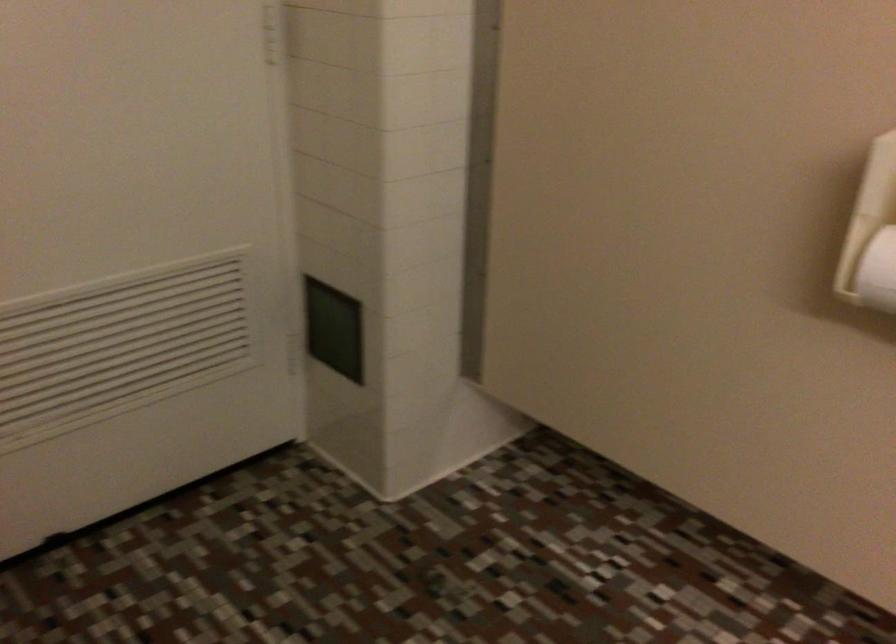
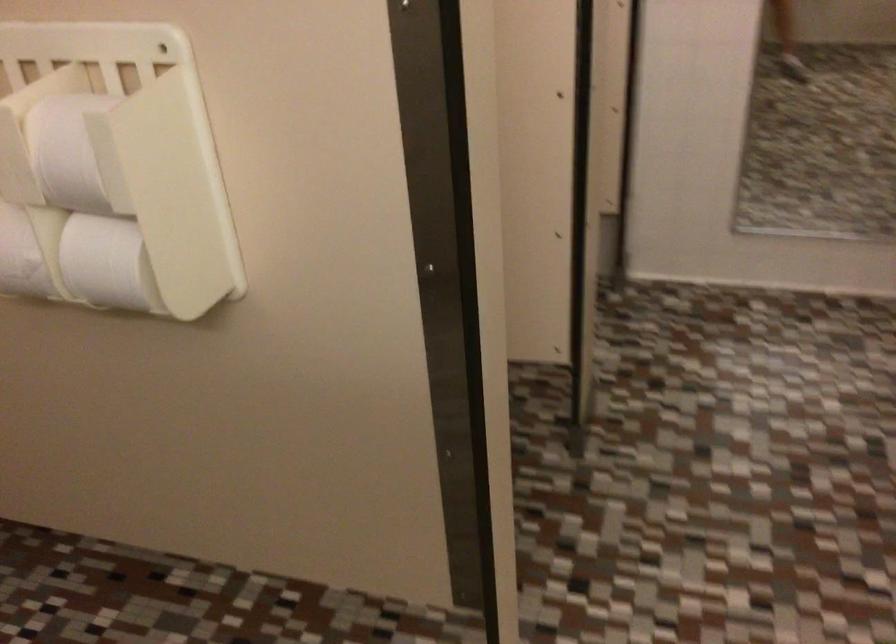
Question: The camera is either moving clockwise (left) or counter-clockwise (right) around the object. The first image is from the beginning of the video and the second image is from the end. Is the camera moving left or right when shooting the video?

Choices:
 (A) Left
 (B) Right

Answer: (A)